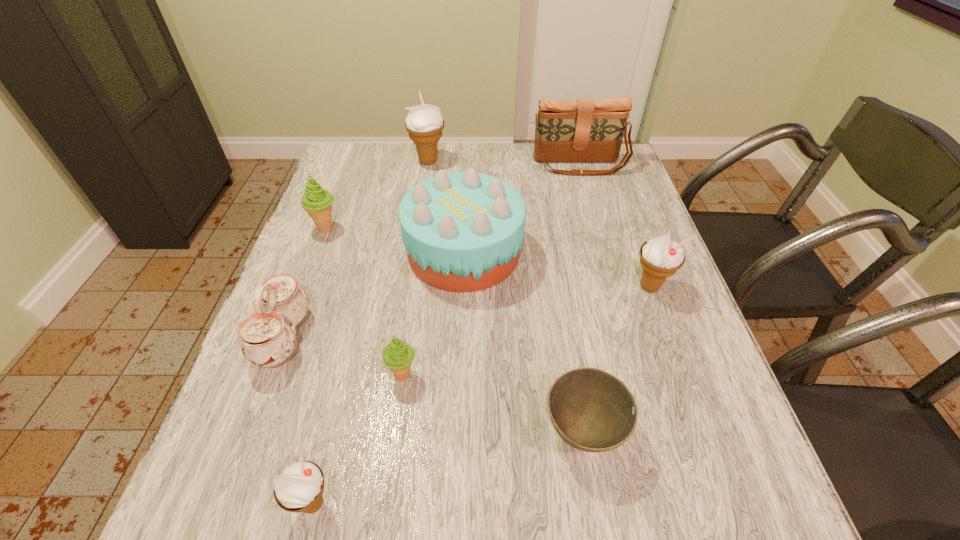
This screenshot has height=540, width=960. What are the coordinates of `the fourth farthest icecream` in the screenshot? It's located at (398, 355).

You are a GUI agent. You are given a task and a screenshot of the screen. Output one action in this format:
    pyautogui.click(x=<x>, y=<y>)
    Task: Click on the fourth icecream from right to left
    This screenshot has height=540, width=960.
    Given the screenshot: What is the action you would take?
    pyautogui.click(x=301, y=483)

What are the coordinates of `the smallest white icecream` in the screenshot? It's located at (301, 483).

Find the location of a particular element. the eighth farthest object is located at coordinates (593, 411).

The image size is (960, 540). Identify the location of the shortest object. (593, 411).

At what (x,y) coordinates should I click in order to perform the action: click on vacant area located 0.320m on the right of the second white icecream from right to left. Please return your answer as a coordinate pair (x, y). Looking at the image, I should click on (548, 161).

I want to click on vacant point located 0.350m on the front-facing side of the shoulder bag, so click(605, 256).

The width and height of the screenshot is (960, 540). In order to click on vacant area located on the front of the cake in this screenshot , I will do `click(462, 316)`.

Locate an element on the screen. This screenshot has height=540, width=960. vacant space located 0.270m on the back of the second smallest white icecream is located at coordinates (619, 204).

At what (x,y) coordinates should I click in order to perform the action: click on free region located on the back of the left green icecream. Please return your answer as a coordinate pair (x, y). This screenshot has height=540, width=960. Looking at the image, I should click on (349, 168).